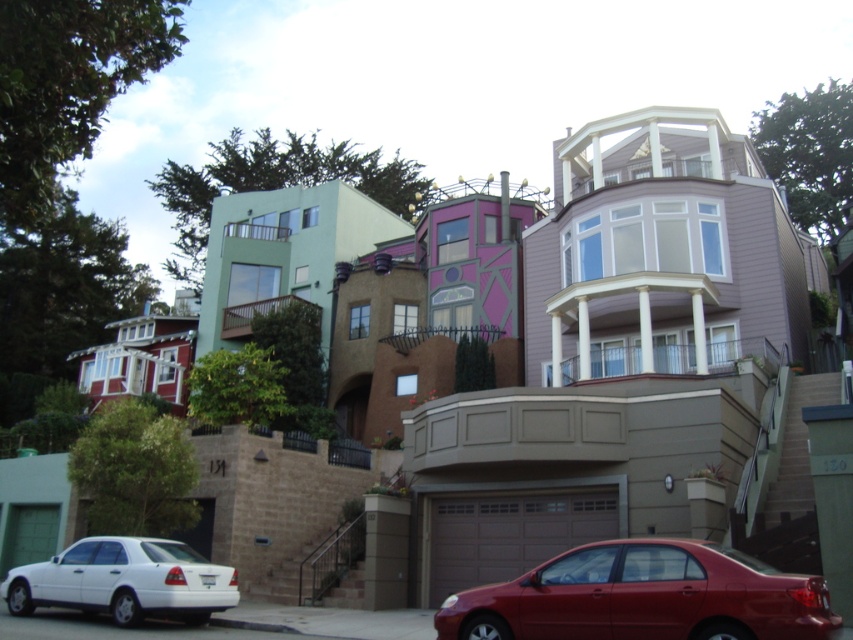
Who is higher up, shiny red sedan at lower center or matte white sedan at lower left?

shiny red sedan at lower center is higher up.

What do you see at coordinates (643, 596) in the screenshot? I see `shiny red sedan at lower center` at bounding box center [643, 596].

Locate an element on the screen. shiny red sedan at lower center is located at coordinates (643, 596).

Locate an element on the screen. Image resolution: width=853 pixels, height=640 pixels. shiny red sedan at lower center is located at coordinates (643, 596).